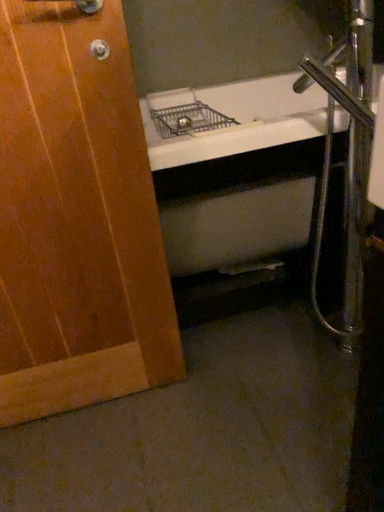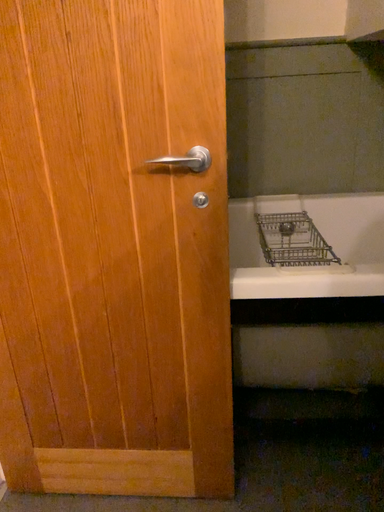
Question: How did the camera likely rotate when shooting the video?

Choices:
 (A) rotated left
 (B) rotated right

Answer: (A)